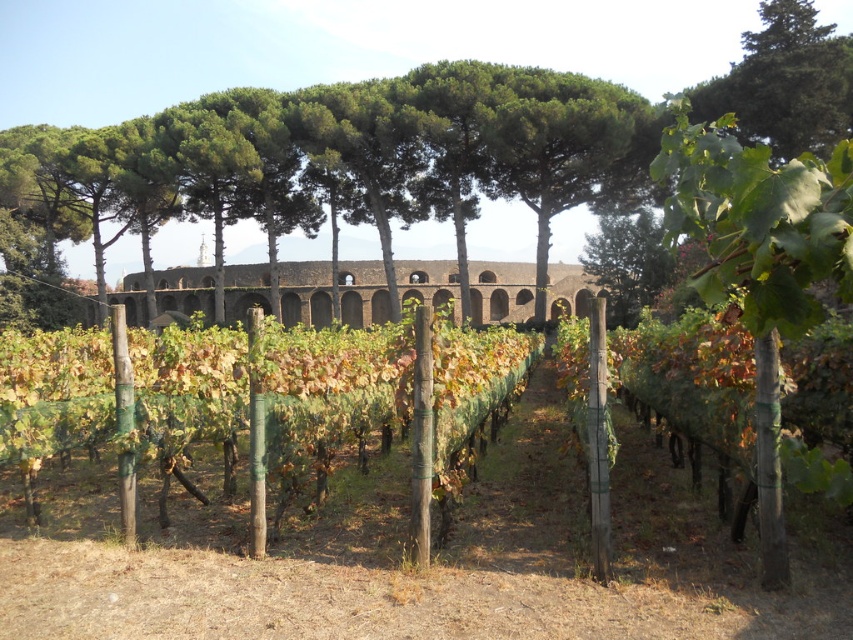
Between point (764, 300) and point (167, 298), which one is positioned in front?

Positioned in front is point (764, 300).

Who is more distant from viewer, (x=757, y=394) or (x=483, y=291)?

The point (x=483, y=291) is behind.

Locate an element on the screen. The width and height of the screenshot is (853, 640). green leafy vine at right is located at coordinates (759, 262).

Find the location of a particular element. green leafy vine at right is located at coordinates (759, 262).